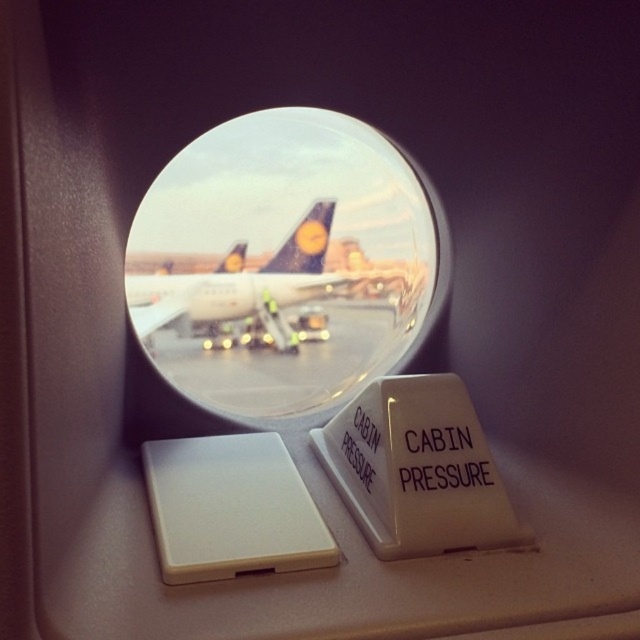
Question: Which point appears farthest from the camera in this image?

Choices:
 (A) (243, 365)
 (B) (198, 316)

Answer: (A)

Question: Is transparent glass airplane window at center wider than white glossy airplane at center?

Choices:
 (A) yes
 (B) no

Answer: (A)

Question: Among these points, which one is nearest to the camera?

Choices:
 (A) (253, 136)
 (B) (189, 282)

Answer: (A)

Question: Among these points, which one is nearest to the camera?

Choices:
 (A) (227, 285)
 (B) (314, 374)
 (C) (333, 312)

Answer: (A)

Question: Does transparent glass airplane window at center have a lesser width compared to smooth concrete tarmac at center?

Choices:
 (A) yes
 (B) no

Answer: (B)

Question: Can you confirm if smooth concrete tarmac at center is positioned above white glossy airplane at center?

Choices:
 (A) yes
 (B) no

Answer: (B)